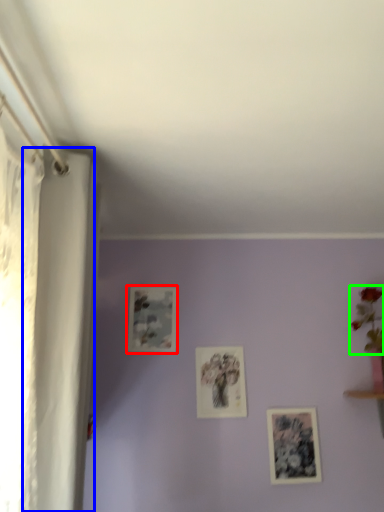
Question: Considering the real-world distances, which object is farthest from picture frame (highlighted by a red box)? curtain (highlighted by a blue box) or floral arrangement (highlighted by a green box)?

Choices:
 (A) curtain
 (B) floral arrangement

Answer: (B)